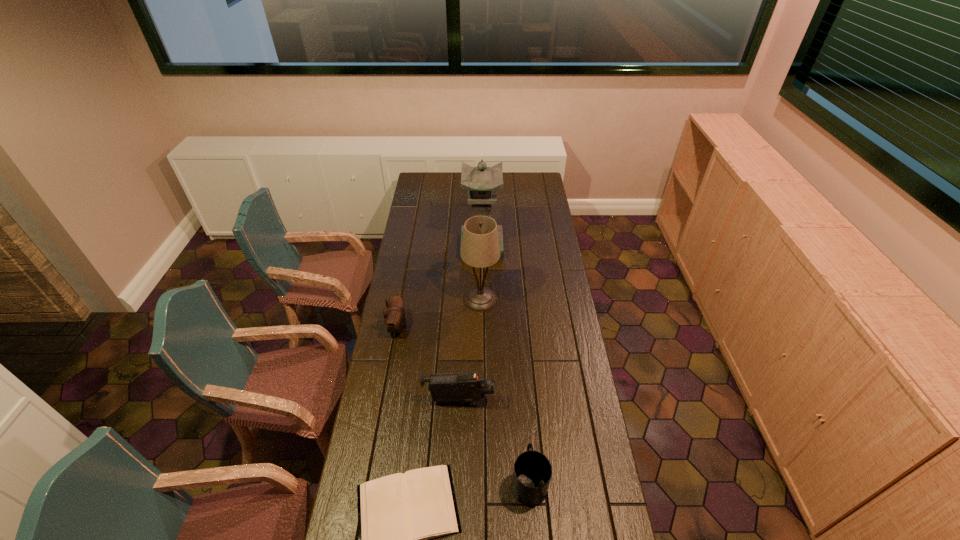
Where is `sculpture`? sculpture is located at coordinates (481, 182).

At what (x,y) coordinates should I click in order to perform the action: click on the fifth nearest object. Please return your answer as a coordinate pair (x, y). Looking at the image, I should click on [x=480, y=248].

This screenshot has height=540, width=960. Find the location of `the second tallest object`. the second tallest object is located at coordinates (480, 248).

Find the location of `the third nearest object`. the third nearest object is located at coordinates (466, 387).

This screenshot has height=540, width=960. Identify the location of the fourth shortest object. (466, 387).

You are a GUI agent. You are given a task and a screenshot of the screen. Output one action in this format:
    pyautogui.click(x=<x>, y=<y>)
    Task: Click on the fourth nearest object
    
    Given the screenshot: What is the action you would take?
    pyautogui.click(x=394, y=317)

Where is `mug`? The height and width of the screenshot is (540, 960). mug is located at coordinates (532, 472).

Identify the location of vacant space located at the front opening of the sculpture. This screenshot has width=960, height=540. 482,287.

Locate an element on the screen. This screenshot has width=960, height=540. free space located 0.130m on the front-facing side of the fifth nearest object is located at coordinates (435, 299).

Image resolution: width=960 pixels, height=540 pixels. Identify the location of free location located 0.170m on the front-facing side of the fifth nearest object. (426, 299).